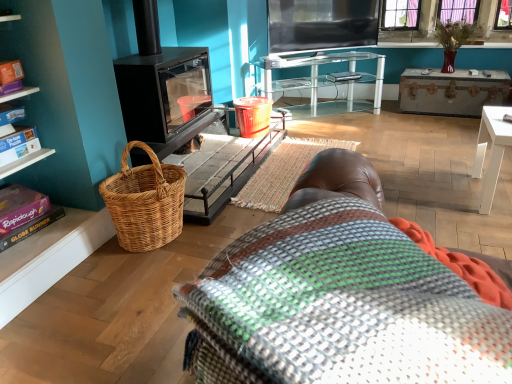
Question: Is multicolored woven blanket at center in contact with purple matte book at lower left?

Choices:
 (A) no
 (B) yes

Answer: (A)

Question: Considering the relative sizes of multicolored woven blanket at center and purple matte book at lower left in the image provided, is multicolored woven blanket at center shorter than purple matte book at lower left?

Choices:
 (A) yes
 (B) no

Answer: (A)

Question: From the image's perspective, does multicolored woven blanket at center appear lower than purple matte book at lower left?

Choices:
 (A) no
 (B) yes

Answer: (A)

Question: Can you confirm if multicolored woven blanket at center is thinner than purple matte book at lower left?

Choices:
 (A) no
 (B) yes

Answer: (A)

Question: Is multicolored woven blanket at center taller than purple matte book at lower left?

Choices:
 (A) yes
 (B) no

Answer: (B)

Question: Is brown leather bean bag chair at lower center bigger or smaller than purple matte book at lower left?

Choices:
 (A) big
 (B) small

Answer: (A)

Question: Does point (348, 276) appear closer or farther from the camera than point (23, 228)?

Choices:
 (A) closer
 (B) farther

Answer: (A)

Question: Considering the positions of brown leather bean bag chair at lower center and purple matte book at lower left in the image, is brown leather bean bag chair at lower center wider or thinner than purple matte book at lower left?

Choices:
 (A) wide
 (B) thin

Answer: (A)

Question: Based on their positions, is brown leather bean bag chair at lower center located to the left or right of purple matte book at lower left?

Choices:
 (A) left
 (B) right

Answer: (B)

Question: From a real-world perspective, is rustic wooden trunk at upper right positioned above or below teal painted wood shelf at left?

Choices:
 (A) below
 (B) above

Answer: (A)

Question: Visually, is rustic wooden trunk at upper right positioned to the left or to the right of teal painted wood shelf at left?

Choices:
 (A) left
 (B) right

Answer: (B)

Question: From their relative heights in the image, would you say rustic wooden trunk at upper right is taller or shorter than teal painted wood shelf at left?

Choices:
 (A) tall
 (B) short

Answer: (B)

Question: Looking at the image, does rustic wooden trunk at upper right seem bigger or smaller compared to teal painted wood shelf at left?

Choices:
 (A) big
 (B) small

Answer: (B)

Question: Looking at their shapes, would you say brown leather bean bag chair at lower center is wider or thinner than woven wicker basket at left?

Choices:
 (A) thin
 (B) wide

Answer: (B)

Question: In terms of size, does brown leather bean bag chair at lower center appear bigger or smaller than woven wicker basket at left?

Choices:
 (A) big
 (B) small

Answer: (A)